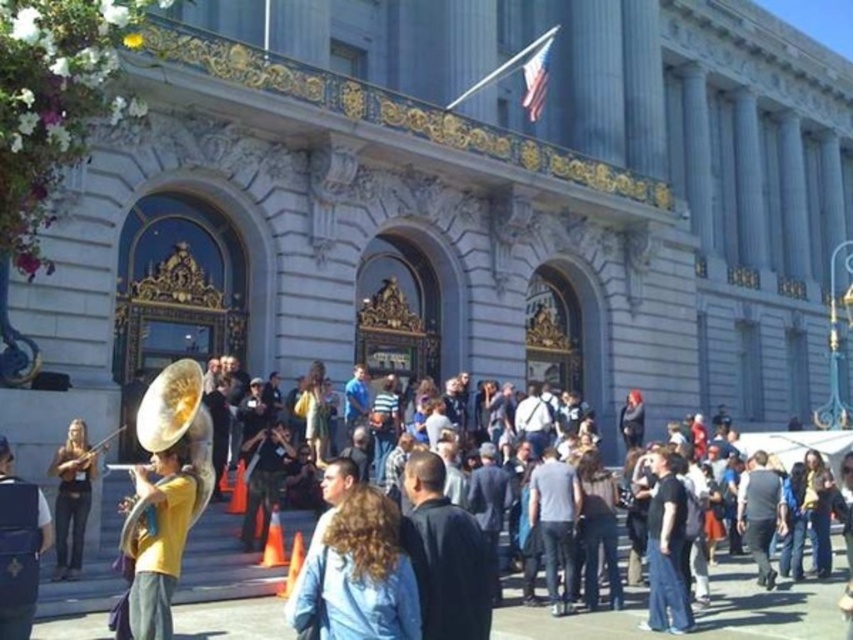
Question: Which object is farther from the camera taking this photo?

Choices:
 (A) yellow t-shirt at left
 (B) matte brown violin at lower left

Answer: (B)

Question: Where is yellow t-shirt at left located in relation to gold metallic tuba at left in the image?

Choices:
 (A) below
 (B) above

Answer: (B)

Question: Is yellow t-shirt at left thinner than matte brown violin at lower left?

Choices:
 (A) no
 (B) yes

Answer: (B)

Question: Observing the image, what is the correct spatial positioning of yellow t-shirt at left in reference to matte brown violin at lower left?

Choices:
 (A) left
 (B) right

Answer: (B)

Question: Which object appears farthest from the camera in this image?

Choices:
 (A) yellow t-shirt at left
 (B) light blue denim jacket at center

Answer: (A)

Question: Which point is farther from the camera taking this photo?

Choices:
 (A) (1, 568)
 (B) (331, 550)
 (C) (77, 486)
 (D) (169, 556)

Answer: (C)